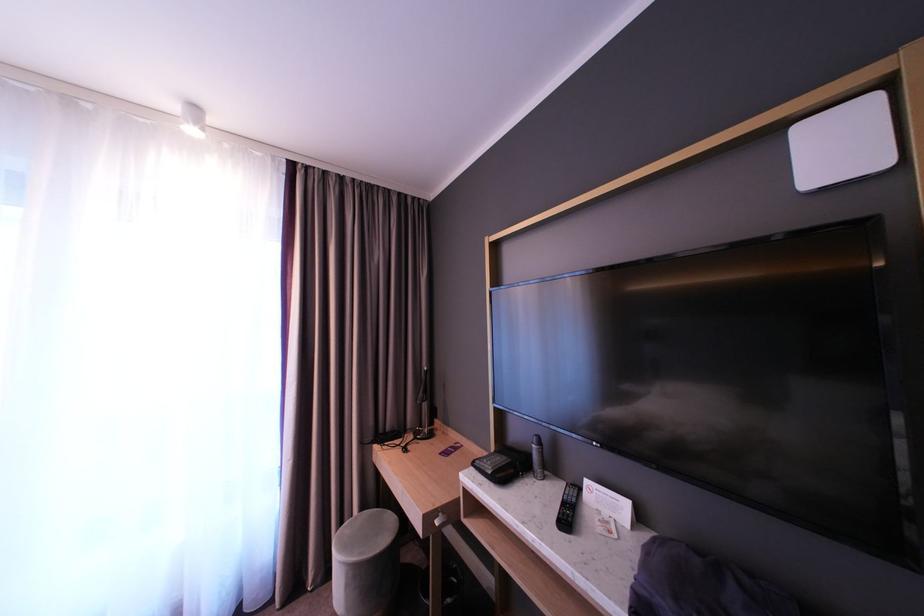
This screenshot has height=616, width=924. What are the coordinates of `black telephone handset` in the screenshot? It's located at (508, 453).